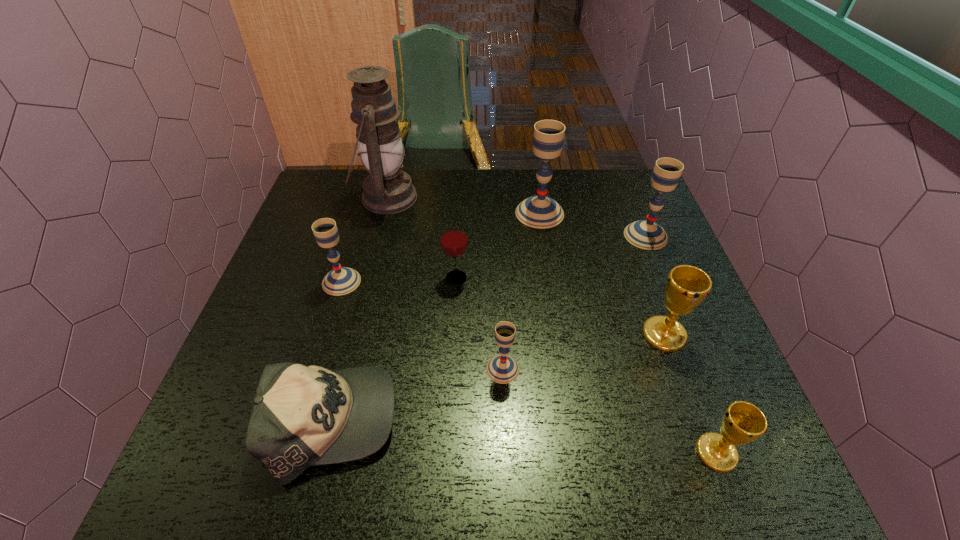
Identify the location of glass. (453, 239).

Where is `red glass`? The image size is (960, 540). red glass is located at coordinates (453, 239).

You are a GUI agent. You are given a task and a screenshot of the screen. Output one action in this format:
    pyautogui.click(x=<x>, y=<y>)
    Task: Click on the fifth farthest chalice
    Image resolution: width=960 pixels, height=540 pixels.
    Given the screenshot: What is the action you would take?
    pyautogui.click(x=502, y=368)

The width and height of the screenshot is (960, 540). Find the location of `the smallest gray chalice`. the smallest gray chalice is located at coordinates (502, 368).

Find the location of a particular element. the nearer gold chalice is located at coordinates (742, 422).

Find the location of `the smaller gold chalice`. the smaller gold chalice is located at coordinates (742, 422).

At what (x,y) coordinates should I click in order to perform the action: click on baseball cap. Please return your answer as a coordinate pair (x, y). Image resolution: width=960 pixels, height=540 pixels. Looking at the image, I should click on (302, 416).

The height and width of the screenshot is (540, 960). Find the location of `the shortest object`. the shortest object is located at coordinates (302, 416).

Identify the location of vacant space located on the front of the oil lamp. Image resolution: width=960 pixels, height=540 pixels. (358, 314).

Locate an element on the screen. The image size is (960, 540). vacant space located 0.160m on the back of the second tallest object is located at coordinates pyautogui.click(x=533, y=170).